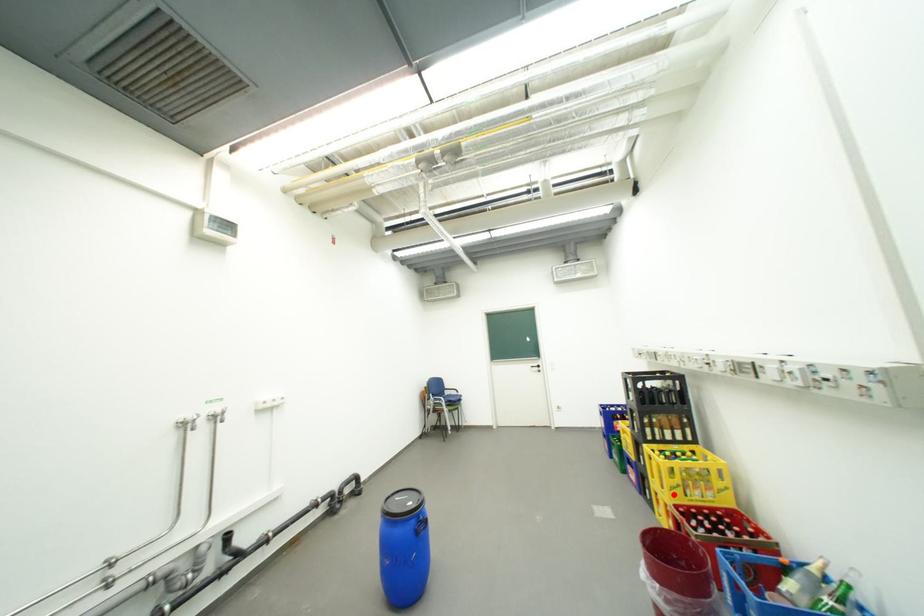
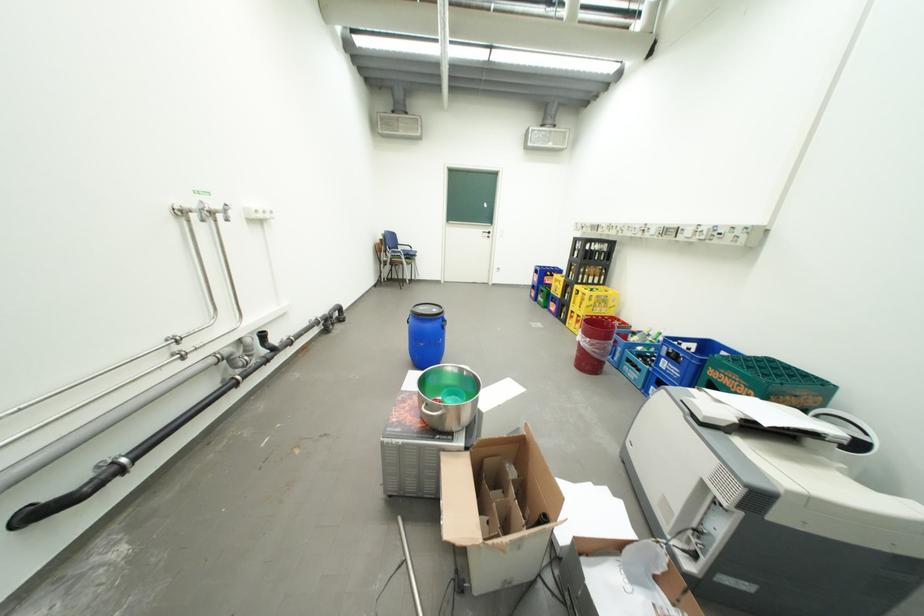
Question: A red point is marked in image1. In image2, is the corresponding 3D point closer to the camera or farther? Reply with the corresponding letter.

Choices:
 (A) The corresponding 3D point is closer.
 (B) The corresponding 3D point is farther.

Answer: (A)